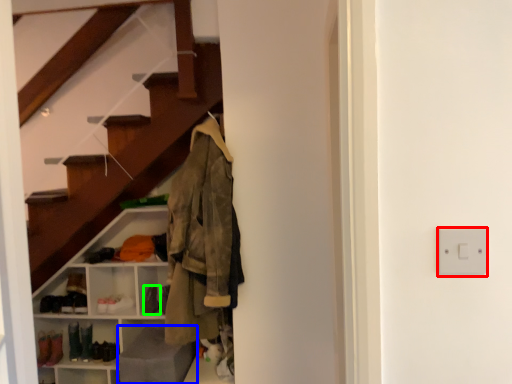
Question: Based on their relative distances, which object is nearer to electric outlet (highlighted by a red box)? Choose from gray (highlighted by a blue box) and shoe (highlighted by a green box).

Choices:
 (A) gray
 (B) shoe

Answer: (A)